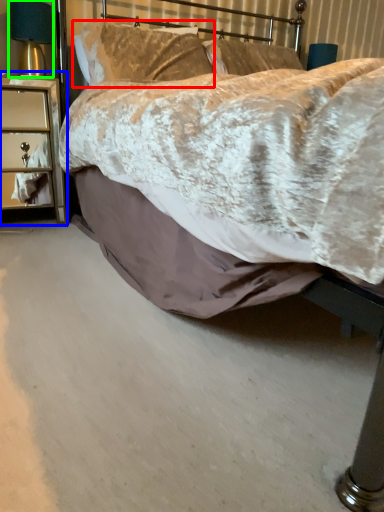
Question: Which is nearer to the pillow (highlighted by a red box)? nightstand (highlighted by a blue box) or bedside lamp (highlighted by a green box).

Choices:
 (A) nightstand
 (B) bedside lamp

Answer: (B)